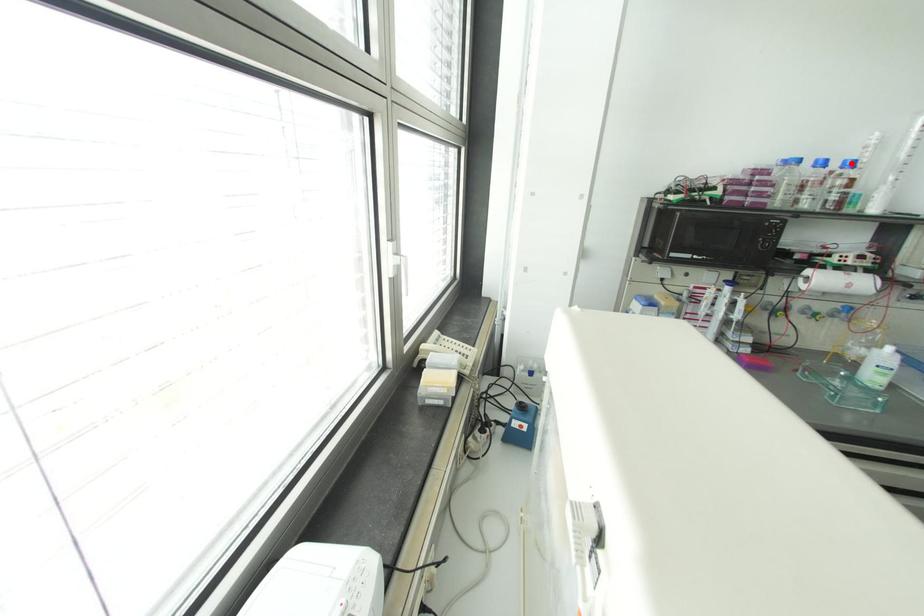
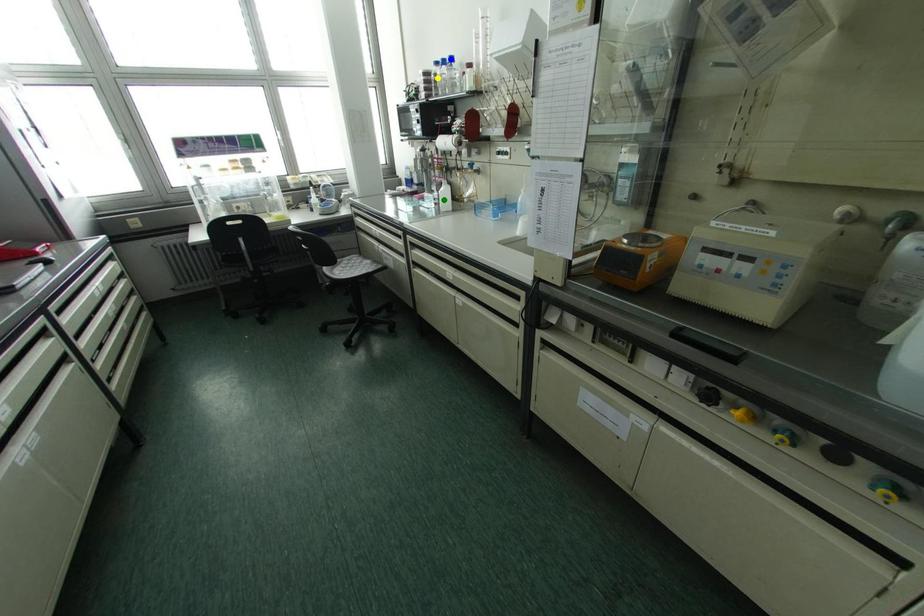
Question: I am providing you with two images of the same scene from different viewpoints. A red point is marked on the first image. You are given multiple points on the second image. Which mark in image 2 goes with the point in image 1?

Choices:
 (A) yellow point
 (B) green point
 (C) blue point

Answer: (C)